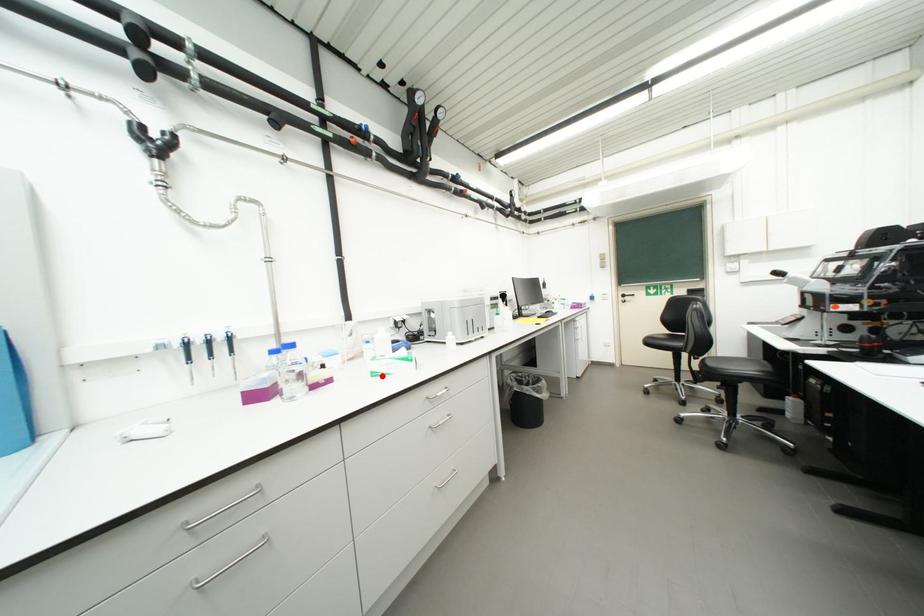
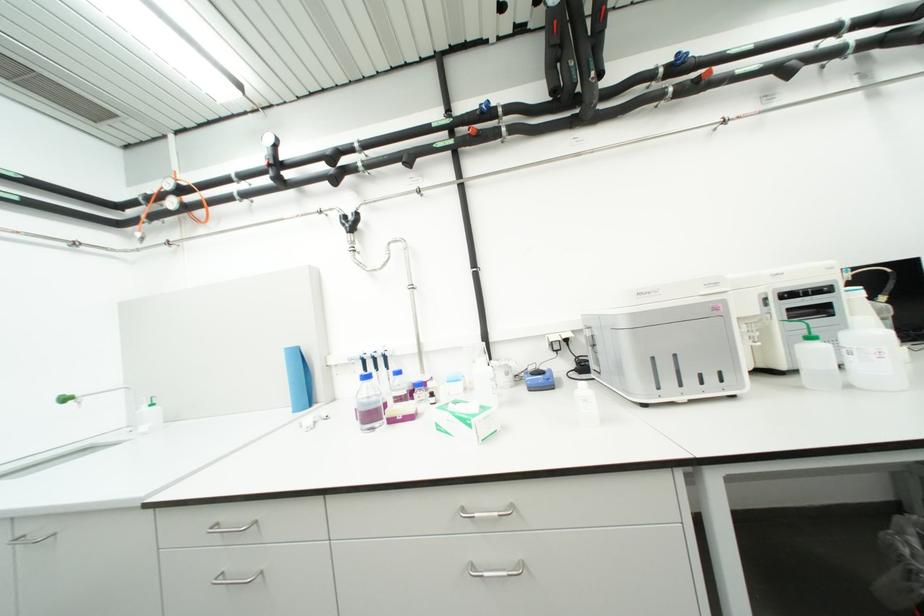
The point at the highlighted location is marked in the first image. Where is the corresponding point in the second image?

(446, 429)